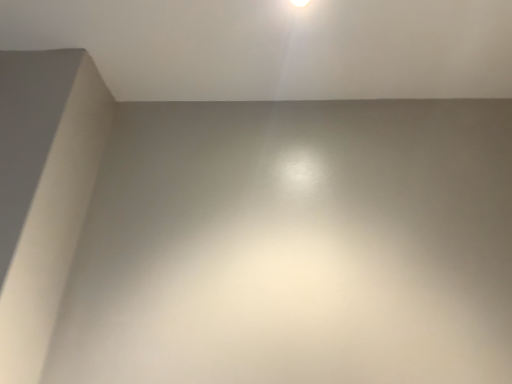
Find the location of a particular element. The image size is (512, 384). white matte wall at upper center is located at coordinates click(277, 47).

The height and width of the screenshot is (384, 512). Describe the element at coordinates (277, 47) in the screenshot. I see `white matte wall at upper center` at that location.

The image size is (512, 384). I want to click on white matte wall at upper center, so (x=277, y=47).